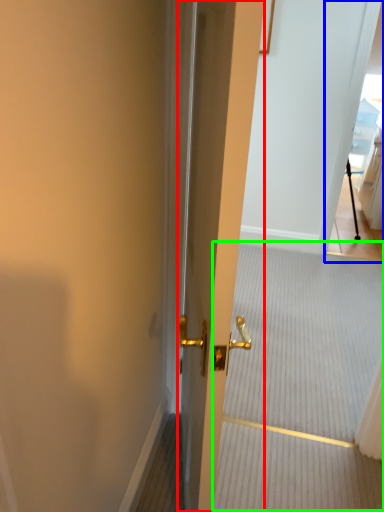
Question: Considering the real-world distances, which object is farthest from door (highlighted by a red box)? glass door (highlighted by a blue box) or stair (highlighted by a green box)?

Choices:
 (A) glass door
 (B) stair

Answer: (A)